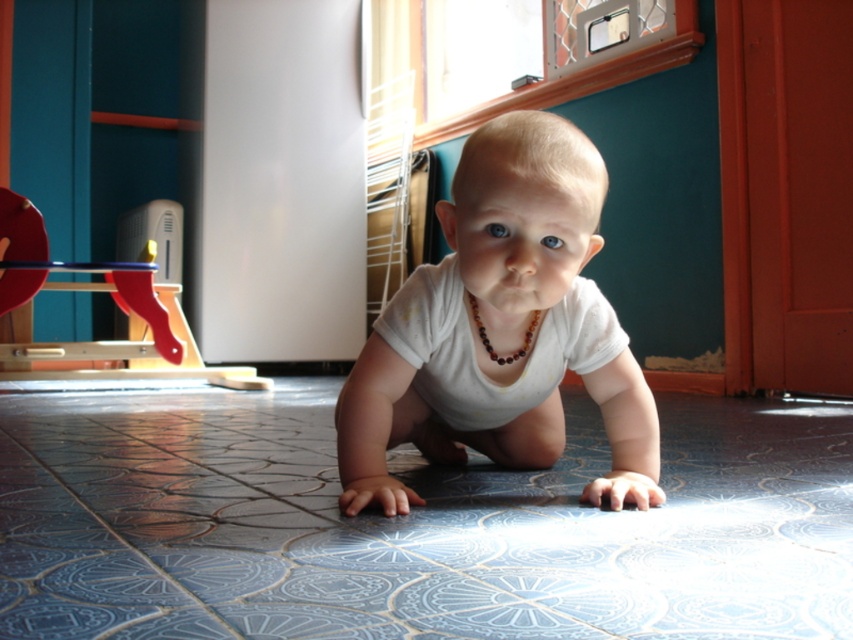
You are a photographer trying to capture the baby in the scene. You need to focus on two specific points in the image labeled as point 1 at (581,468) and point 2 at (140,301). Which point should you focus on first to ensure the baby is in sharp focus?

Point 1 at (581,468) is closer to the viewer than point 2 at (140,301), so focusing on point 1 first will ensure the baby is in sharp focus.

You are a parent trying to ensure your baby stays within a safe play area. The wooden toy at left is near the edge of the play area, and the white matte onesie at center is in the middle. Which object is closer to the edge of the play area?

The wooden toy at left is closer to the edge of the play area because it is positioned to the left of the white matte onesie at center, which is in the middle.